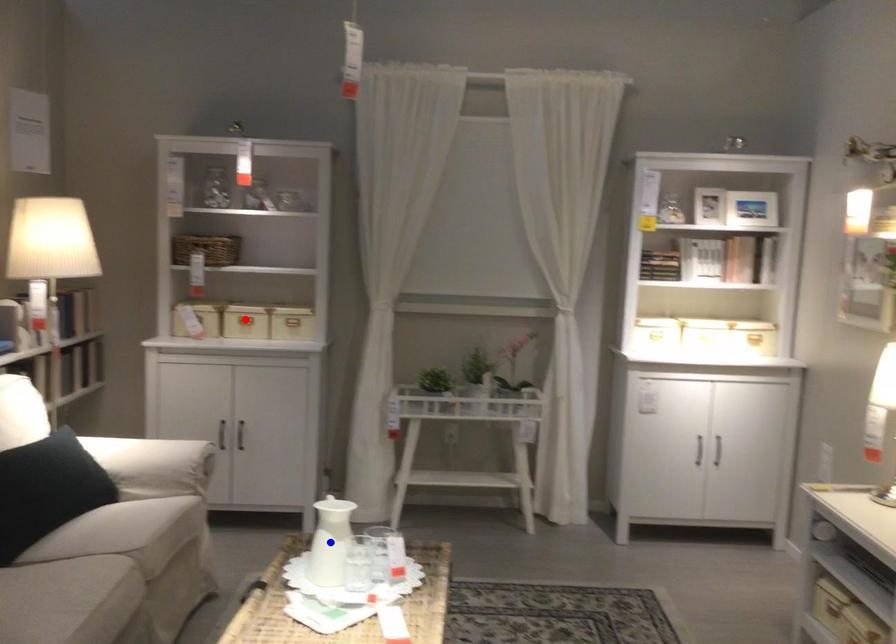
Question: In the image, two points are highlighted. Which point is nearer to the camera? Reply with the corresponding letter.

Choices:
 (A) blue point
 (B) red point

Answer: (A)